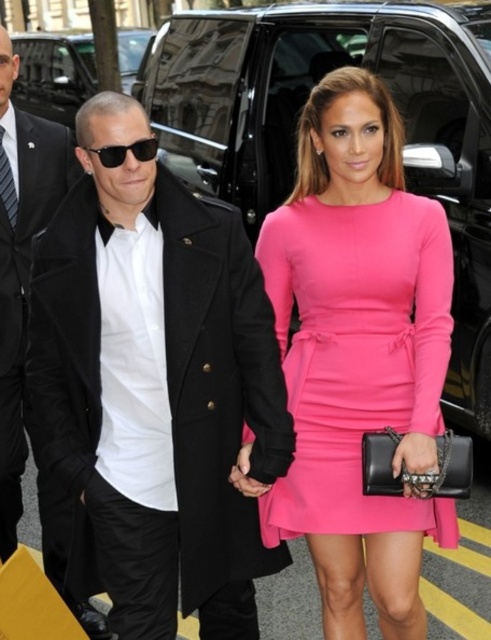
You are a photographer standing at the camera position. You want to take a closeup shot of the black wool coat at center without moving the camera. Can you zoom in enough to capture the coat clearly?

The black wool coat at center is 2.71 meters away from the camera, so yes, you can zoom in enough to capture the coat clearly as it is within a reasonable distance for a closeup shot.

You are a photographer positioned at the end of the street. You want to capture a photo where both the black wool coat at center and the matte pink dress at center are clearly visible. Based on their positions, which object should you focus on first to ensure both are in focus?

The black wool coat at center is in front of the matte pink dress at center. To ensure both are in focus, you should focus on the black wool coat at center first since it is closer to the camera, and the depth of field may naturally include the matte pink dress at center in the background.

You are a photographer positioned at the back of the black vehicle. You want to take a photo of both the black wool coat at center and the black wool coat at left. Which coat should you focus on first to ensure both are in frame?

The black wool coat at center is located below the black wool coat at left, so you should focus on the black wool coat at left first to ensure both are in frame.